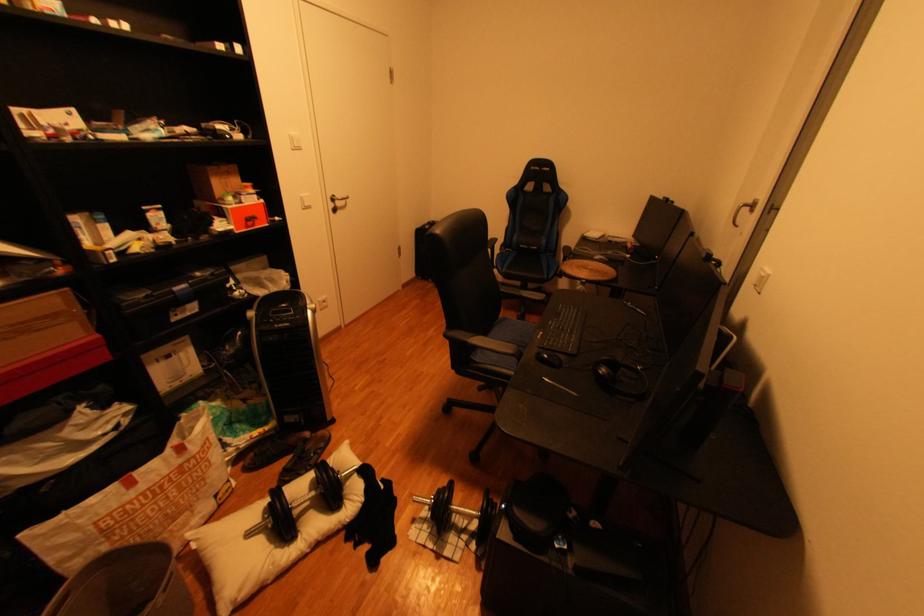
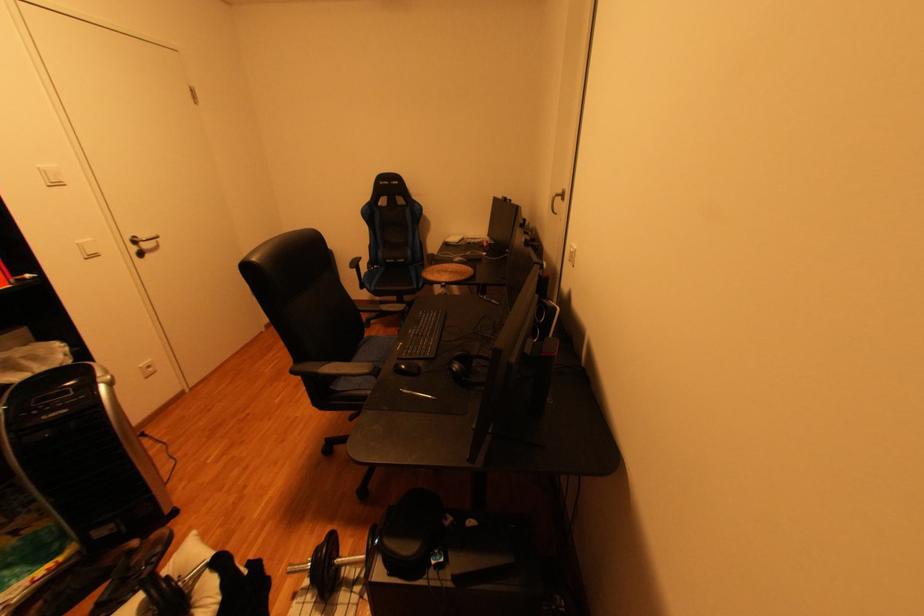
In the second image, find the point that corresponds to (x=555, y=357) in the first image.

(411, 367)